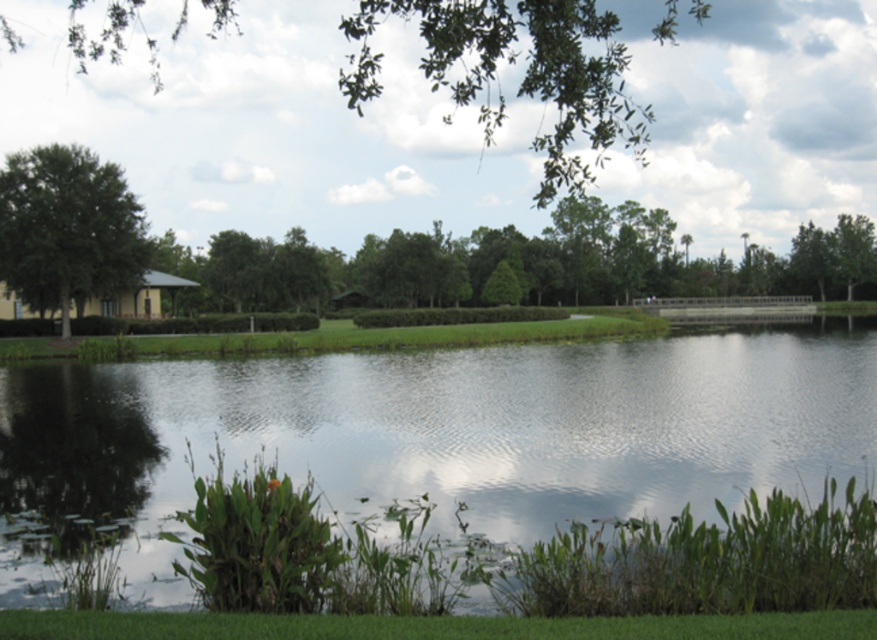
You are standing in the park and want to take a photo of both the green leafy tree at upper center and the green leafy tree at left. Which tree should you position closer to the camera to include both in the frame without cropping?

The green leafy tree at upper center might be wider than the green leafy tree at left, so you should position closer to the wider tree to ensure both fit in the frame.

You are standing at the center of the image and want to walk towards the clear water at center. According to the coordinates provided, in which direction should you move?

The clear water at center is located at point 0.680 on the x axis and 0.501 on the y axis. Since you are at the center, which is at 0.5 on both axes, you should move to the right to reach the clear water at center.

You are standing at the edge of the clear water at center and want to throw a stone into the water. If you can throw a stone 8 meters, will it land in the water?

The clear water at center is 8.16 meters away from the viewer. Since the viewer can only throw 8 meters, the stone will not reach the water.